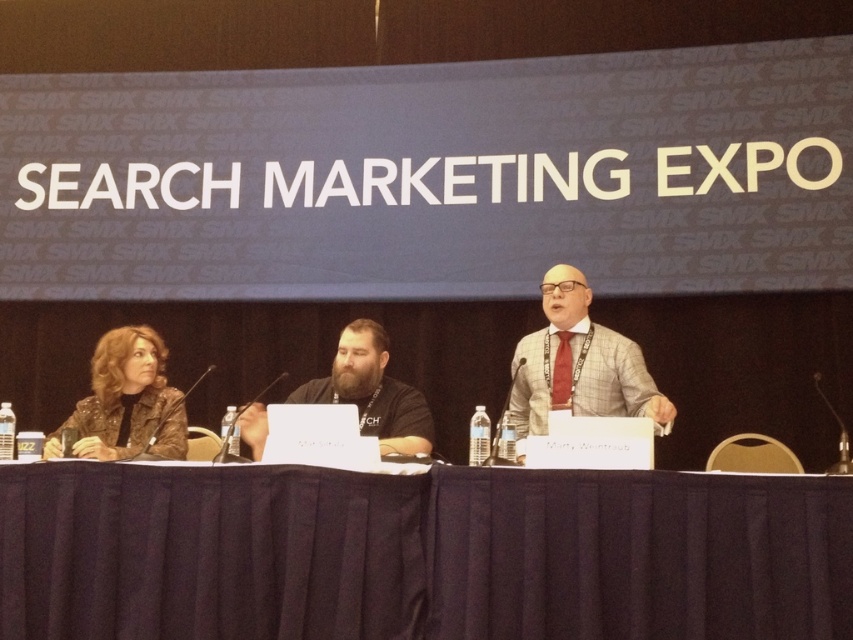
You are organizing a panel discussion and need to ensure that the sparkly black jacket at left can fit on the black fabric table at center. Based on the scene description, will the jacket fit on the table?

The black fabric table at center has a larger width than the sparkly black jacket at left, so the jacket will fit on the table.

Based on the photo, you are a photographer at the event and want to capture a closeup of the laptop and microphone on the table. The laptop and microphone are located at point (x=409, y=541) and point (x=616, y=388) respectively. Which object should you focus on first to ensure it appears clearer in the photo?

You should focus on the laptop and microphone located at point (x=409, y=541) first because it is closer to the camera than the other point, ensuring it will appear clearer in the photo.